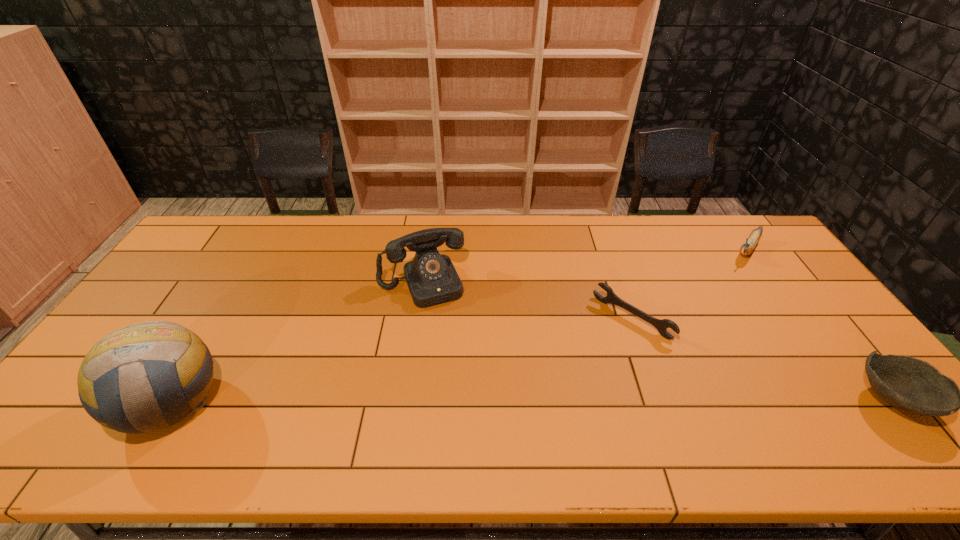
Locate an element on the screen. free space on the desktop that is between the leftmost object and the bowl and is positioned on the dial of the fourth shortest object is located at coordinates (467, 401).

Locate an element on the screen. free space on the desktop that is between the volleyball and the bowl and is positioned on the open ends of the wrench is located at coordinates (552, 401).

The image size is (960, 540). Identify the location of vacant spot on the desktop that is between the tallest object and the bowl and is positioned at the stem of the banana. (636, 401).